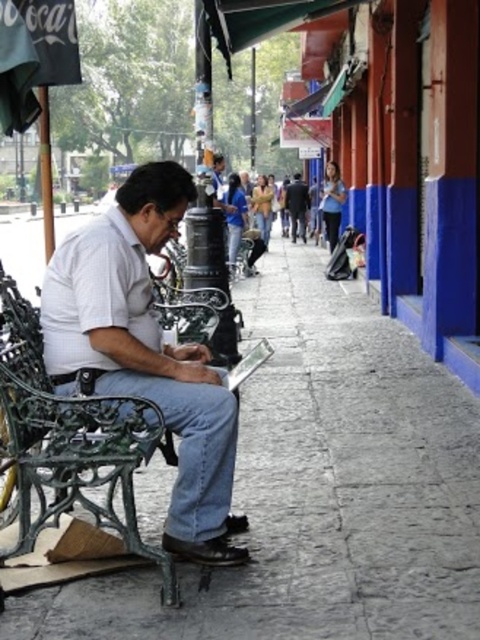
Question: Does gray stone pavement at lower center have a larger size compared to dark blue jacket at center?

Choices:
 (A) yes
 (B) no

Answer: (A)

Question: Is gray stone pavement at lower center to the left of white cotton shirt at center from the viewer's perspective?

Choices:
 (A) yes
 (B) no

Answer: (A)

Question: Which object is farther from the camera taking this photo?

Choices:
 (A) dark blue jacket at center
 (B) white cotton shirt at center
 (C) gray stone pavement at lower center
 (D) green wrought iron bench at left

Answer: (A)

Question: Estimate the real-world distances between objects in this image. Which object is closer to the green wrought iron bench at left?

Choices:
 (A) gray stone pavement at lower center
 (B) dark blue jacket at center

Answer: (A)

Question: Is gray stone pavement at lower center in front of dark blue jacket at center?

Choices:
 (A) yes
 (B) no

Answer: (A)

Question: Estimate the real-world distances between objects in this image. Which object is closer to the green wrought iron bench at left?

Choices:
 (A) gray stone pavement at lower center
 (B) dark blue jacket at center
 (C) white cotton shirt at center

Answer: (C)